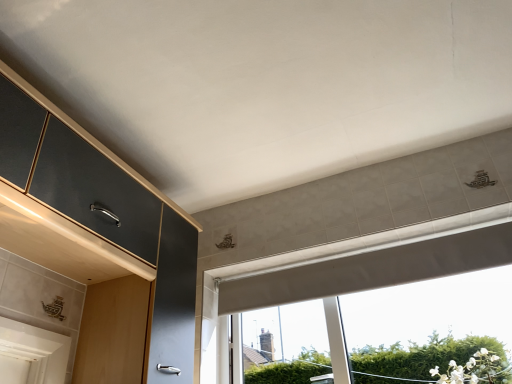
Question: Based on their sizes in the image, would you say white matte window at center is bigger or smaller than matte black cabinet at left?

Choices:
 (A) small
 (B) big

Answer: (A)

Question: From the image's perspective, is white matte window at center positioned above or below matte black cabinet at left?

Choices:
 (A) below
 (B) above

Answer: (A)

Question: Is point (484, 238) closer or farther from the camera than point (19, 147)?

Choices:
 (A) farther
 (B) closer

Answer: (A)

Question: Which is correct: matte black cabinet at left is inside white matte window at center, or outside of it?

Choices:
 (A) outside
 (B) inside

Answer: (A)

Question: In terms of height, does matte black cabinet at left look taller or shorter compared to white matte window at center?

Choices:
 (A) tall
 (B) short

Answer: (A)

Question: From a real-world perspective, is matte black cabinet at left above or below white matte window at center?

Choices:
 (A) below
 (B) above

Answer: (B)

Question: Considering the positions of matte black cabinet at left and white matte window at center in the image, is matte black cabinet at left wider or thinner than white matte window at center?

Choices:
 (A) thin
 (B) wide

Answer: (B)